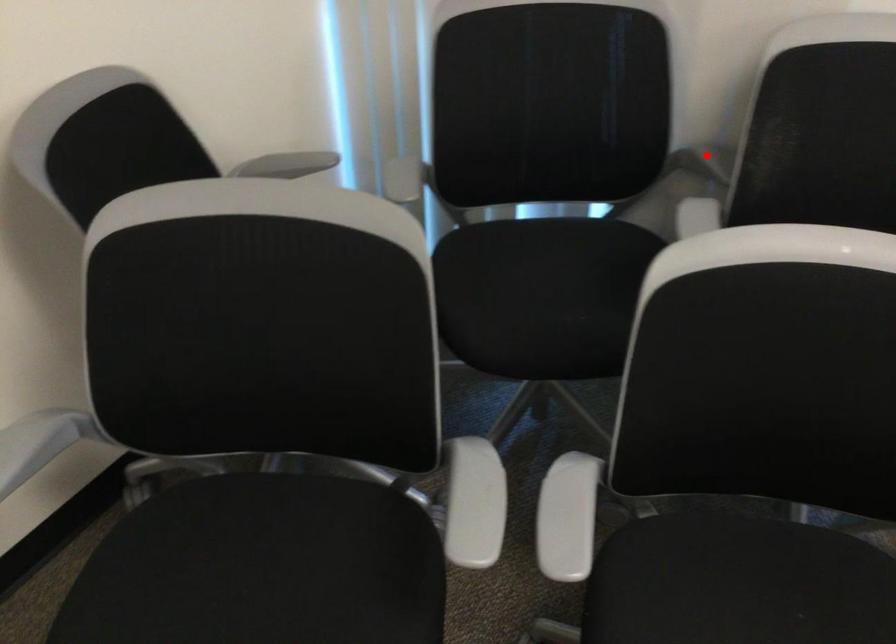
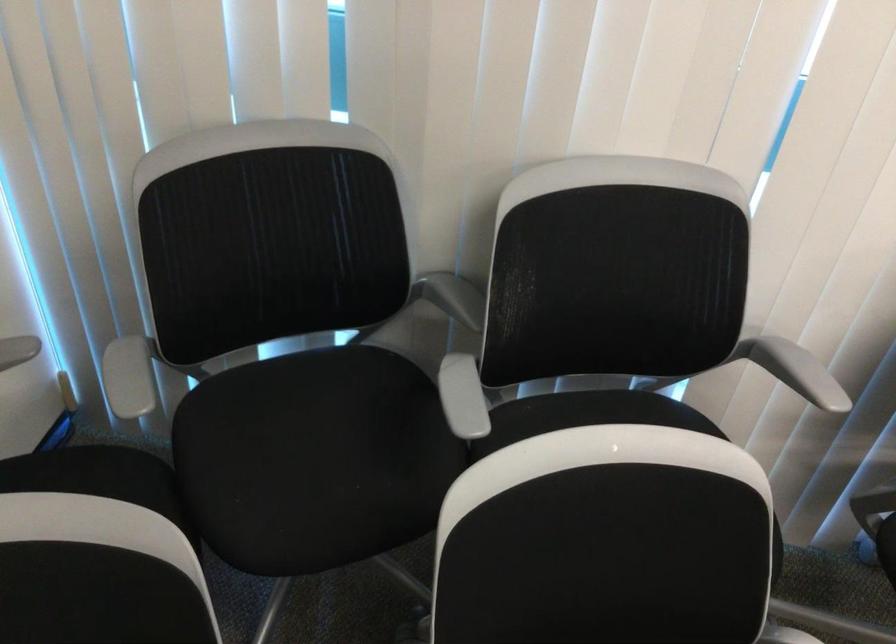
Where in the second image is the point corresponding to the highlighted location from the first image?

(453, 297)